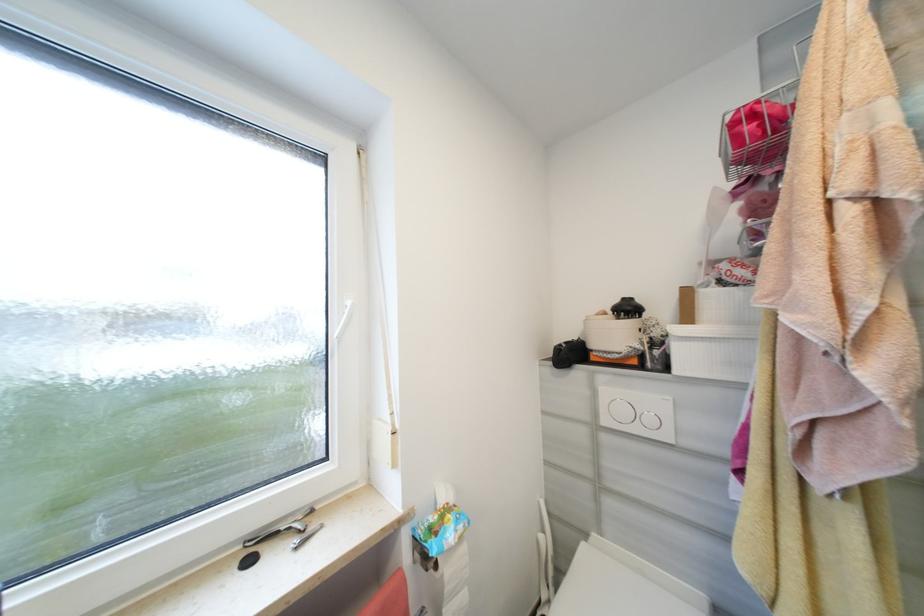
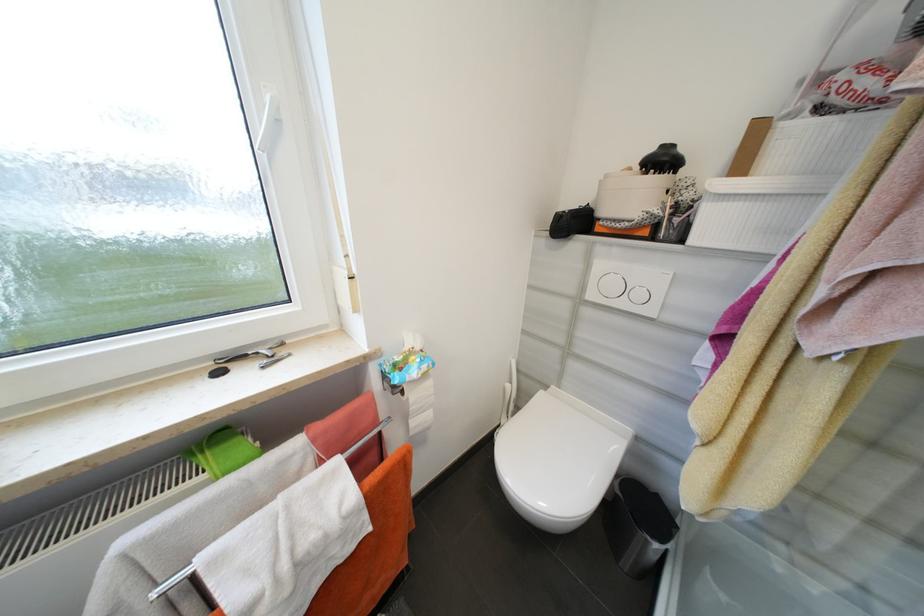
In the second image, find the point that corresponds to point (296, 530) in the first image.

(262, 354)